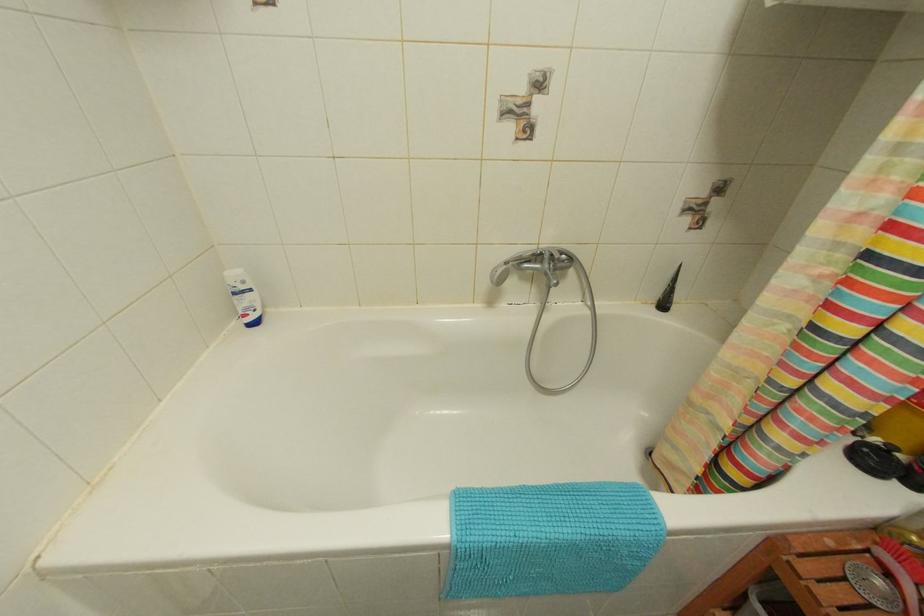
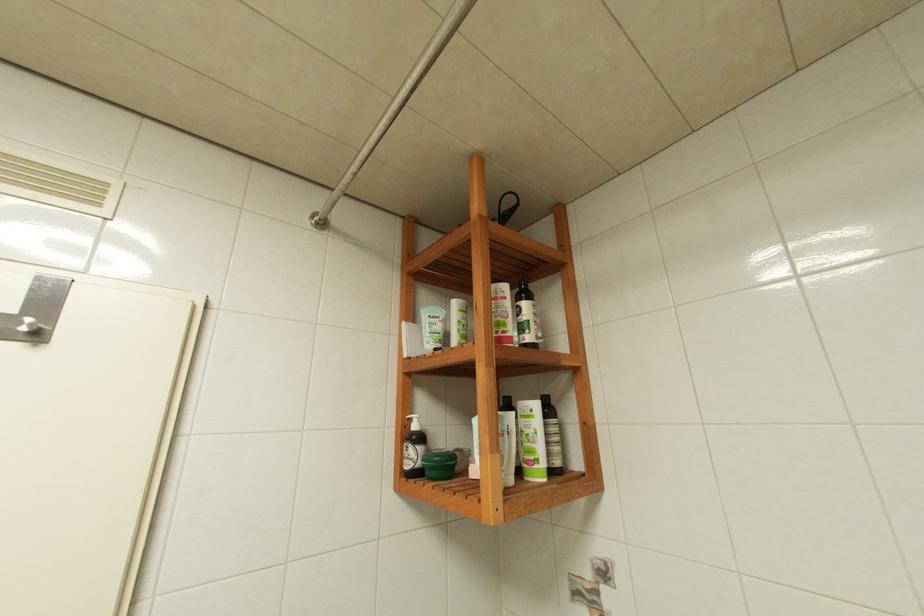
How did the camera likely rotate?

The camera rotated toward left-up.